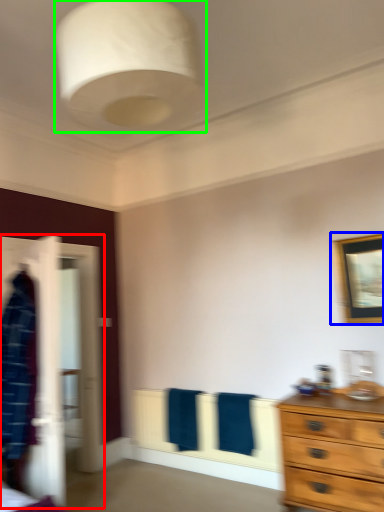
Question: Based on their relative distances, which object is farther from closet (highlighted by a red box)? Choose from picture frame (highlighted by a blue box) and light fixture (highlighted by a green box).

Choices:
 (A) picture frame
 (B) light fixture

Answer: (B)